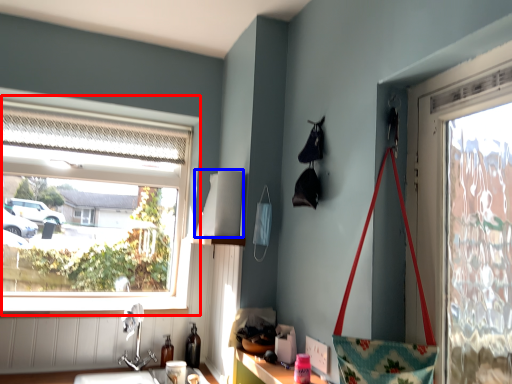
Question: Which object appears closest to the camera in this image, window (highlighted by a red box) or lampshade (highlighted by a blue box)?

Choices:
 (A) window
 (B) lampshade

Answer: (B)